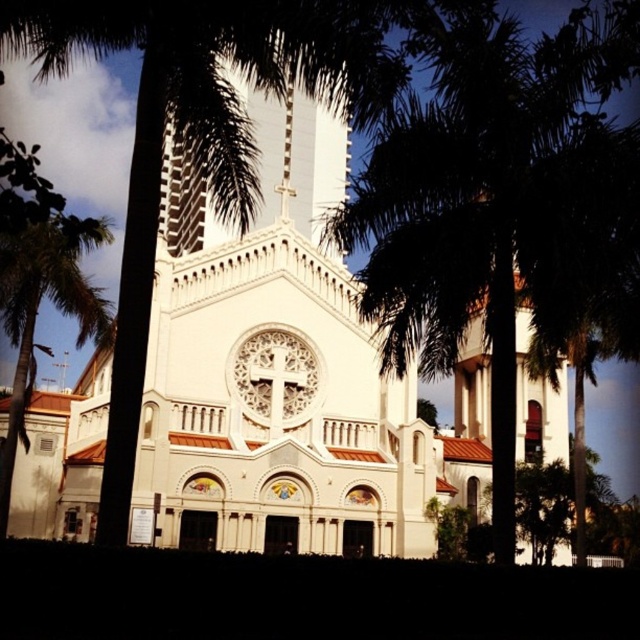
Can you confirm if white stone church at center is positioned to the right of green leafy palm tree at center?

Incorrect, white stone church at center is not on the right side of green leafy palm tree at center.

Who is more forward, (330,157) or (572,150)?

Answer: Point (572,150) is more forward.

Is point (396, 460) behind point (547, 99)?

Yes, point (396, 460) is farther from viewer.

At what (x,y) coordinates should I click in order to perform the action: click on white stone church at center. Please return your answer as a coordinate pair (x, y). Looking at the image, I should click on point(289,372).

I want to click on white stone church at center, so click(x=289, y=372).

Who is taller, white stone church at center or green leafy palm tree at left?

With more height is white stone church at center.

Is point (269, 300) farther from viewer compared to point (99, 241)?

Yes.

The width and height of the screenshot is (640, 640). I want to click on white stone church at center, so click(x=289, y=372).

Is point (417, 221) positioned before point (16, 445)?

Yes, point (417, 221) is in front of point (16, 445).

Locate an element on the screen. The height and width of the screenshot is (640, 640). green leafy palm tree at center is located at coordinates [x=502, y=198].